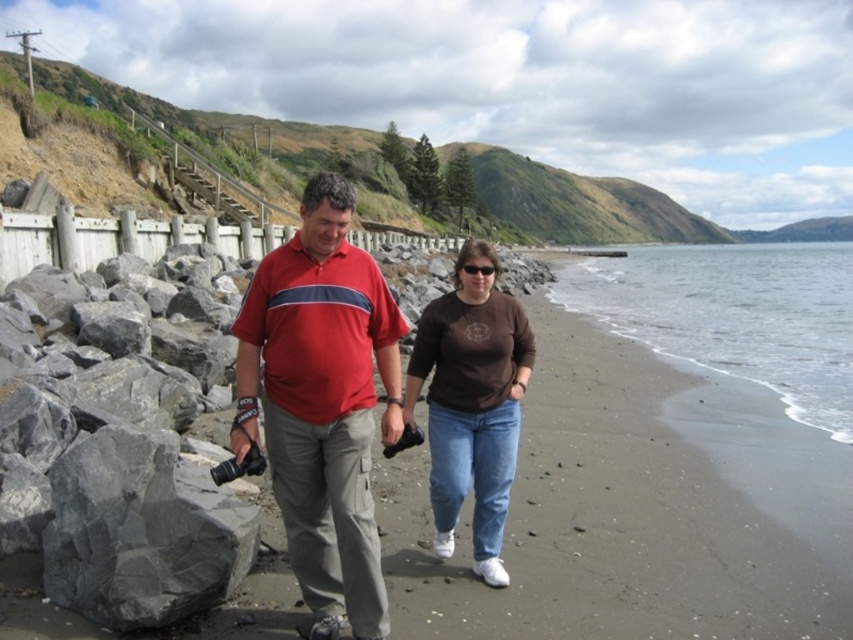
Question: Does gray sand at lower right appear on the right side of gray rock at lower left?

Choices:
 (A) yes
 (B) no

Answer: (A)

Question: Which of these objects is positioned farthest from the matte red shirt at center?

Choices:
 (A) gray rock at lower left
 (B) smooth sand beach at center
 (C) black plastic sunglasses at center
 (D) gray sand at lower right

Answer: (D)

Question: Is gray sand at lower right thinner than brown matte shirt at center?

Choices:
 (A) yes
 (B) no

Answer: (B)

Question: Which point appears closest to the camera in this image?

Choices:
 (A) (637, 275)
 (B) (297, 304)
 (C) (45, 582)
 (D) (494, 532)

Answer: (C)

Question: Does smooth sand beach at center appear under black plastic sunglasses at center?

Choices:
 (A) no
 (B) yes

Answer: (B)

Question: Which of the following is the farthest from the observer?

Choices:
 (A) matte red shirt at center
 (B) black plastic sunglasses at center
 (C) brown matte shirt at center

Answer: (B)